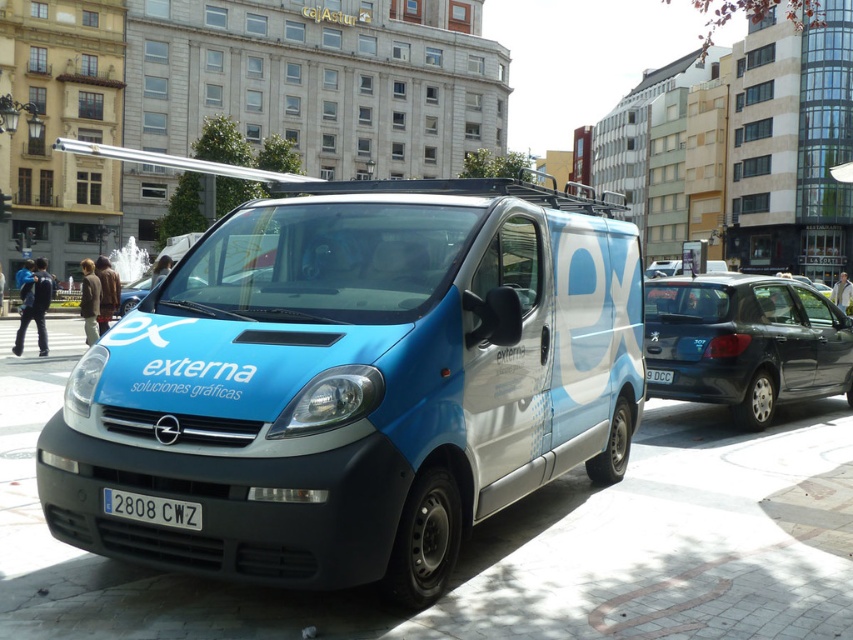
Does blue concrete pavement at center have a lesser width compared to black plastic license plate at center?

In fact, blue concrete pavement at center might be wider than black plastic license plate at center.

Can you confirm if blue concrete pavement at center is positioned below black plastic license plate at center?

Correct, blue concrete pavement at center is located below black plastic license plate at center.

Between point (802, 465) and point (186, 525), which one is positioned behind?

Point (802, 465)

Locate an element on the screen. The image size is (853, 640). blue concrete pavement at center is located at coordinates (497, 544).

Is point (683, 390) positioned after point (659, 378)?

That is False.

Which is behind, point (807, 328) or point (666, 381)?

Point (807, 328)

Where is `glossy dark blue hatchback at right`? The width and height of the screenshot is (853, 640). glossy dark blue hatchback at right is located at coordinates (746, 342).

Based on the photo, does blue metallic van at center have a lesser height compared to glossy dark blue hatchback at right?

No, blue metallic van at center is not shorter than glossy dark blue hatchback at right.

Can you confirm if blue metallic van at center is thinner than glossy dark blue hatchback at right?

In fact, blue metallic van at center might be wider than glossy dark blue hatchback at right.

Which is behind, point (427, 316) or point (824, 355)?

Point (824, 355)

Find the location of a particular element. blue metallic van at center is located at coordinates (352, 378).